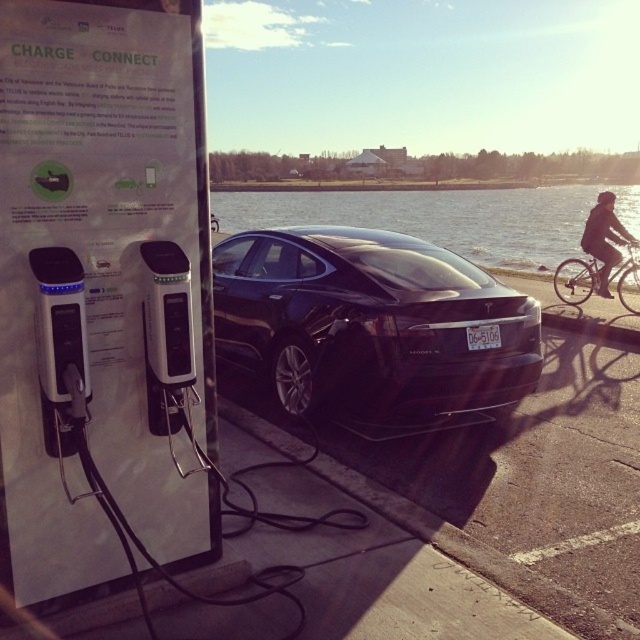
Between point (419, 413) and point (333, 193), which one is positioned behind?

Positioned behind is point (333, 193).

Is black glossy sedan at center smaller than transparent glass water at center?

Yes, black glossy sedan at center is smaller than transparent glass water at center.

Is point (499, 300) closer to viewer compared to point (486, 260)?

That is True.

Locate an element on the screen. black glossy sedan at center is located at coordinates (372, 326).

Can you confirm if transparent glass water at center is bigger than dark fabric jacket at upper right?

Indeed, transparent glass water at center has a larger size compared to dark fabric jacket at upper right.

Is point (428, 237) farther from viewer compared to point (600, 198)?

Yes.

This screenshot has height=640, width=640. What do you see at coordinates (435, 218) in the screenshot?
I see `transparent glass water at center` at bounding box center [435, 218].

Find the location of a particular element. The image size is (640, 640). transparent glass water at center is located at coordinates (435, 218).

Locate an element on the screen. silver metallic bicycle at right is located at coordinates point(576,280).

Does silver metallic bicycle at right have a greater height compared to dark fabric jacket at upper right?

Incorrect, silver metallic bicycle at right's height is not larger of dark fabric jacket at upper right's.

Does point (620, 276) lie behind point (605, 234)?

That is False.

Identify the location of silver metallic bicycle at right. (576, 280).